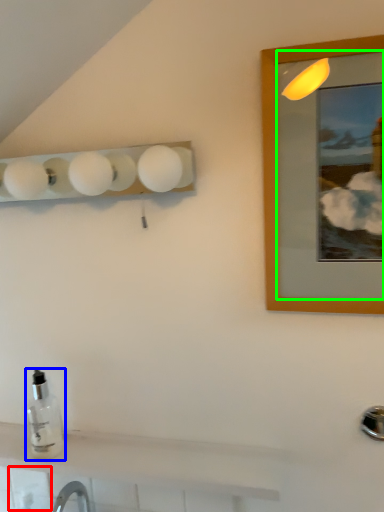
Question: Which object is positioned closest to tile (highlighted by a red box)? Select from bottle (highlighted by a blue box) and mirror (highlighted by a green box).

Choices:
 (A) bottle
 (B) mirror

Answer: (A)